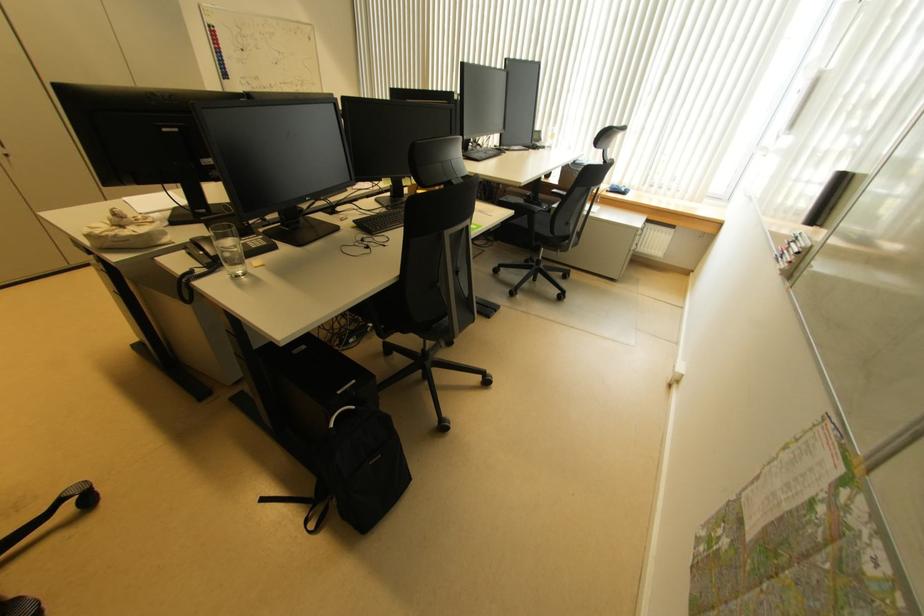
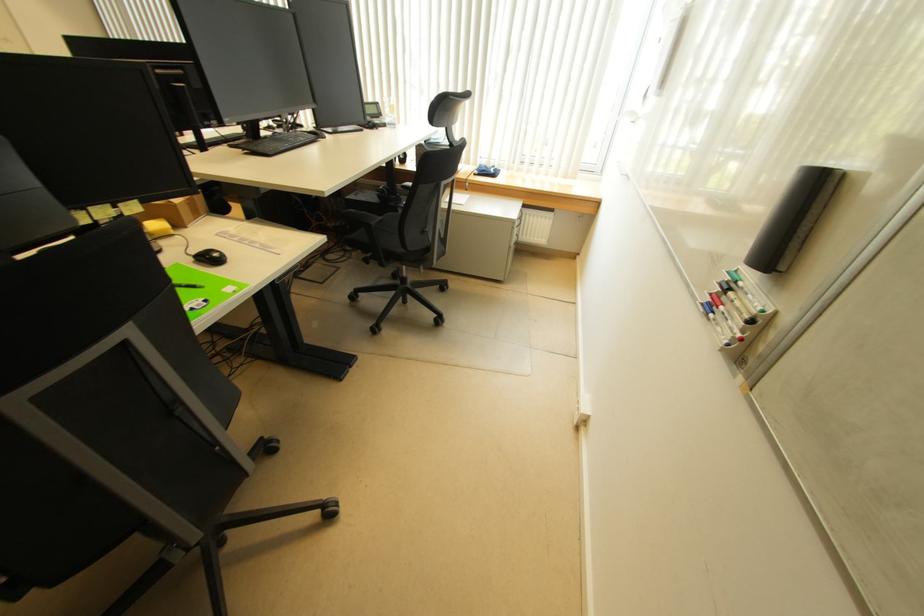
Question: The first image is from the beginning of the video and the second image is from the end. How did the camera likely rotate when shooting the video?

Choices:
 (A) Left
 (B) Right
 (C) Up
 (D) Down

Answer: (B)